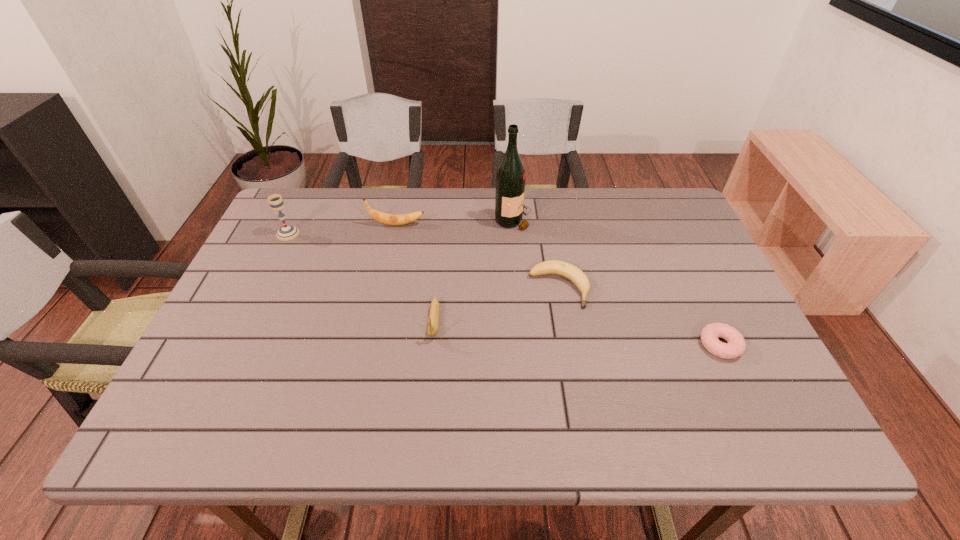
At what (x,y) coordinates should I click in order to perform the action: click on free point that satisfies the following two spatial constraints: 1. on the peel of the tallest banana from the top; 2. on the front side of the leftmost object. Please return your answer as a coordinate pair (x, y). The width and height of the screenshot is (960, 540). Looking at the image, I should click on (395, 233).